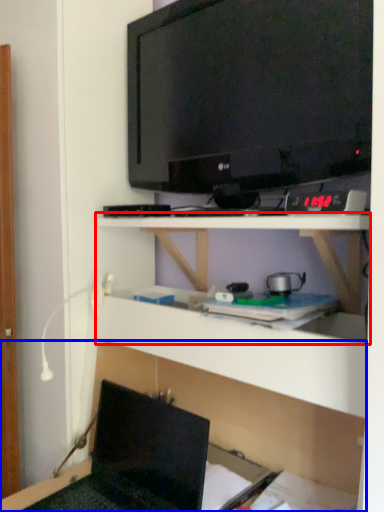
Question: Which of the following is the closest to the observer, shelf (highlighted by a red box) or shelf (highlighted by a blue box)?

Choices:
 (A) shelf
 (B) shelf

Answer: (B)